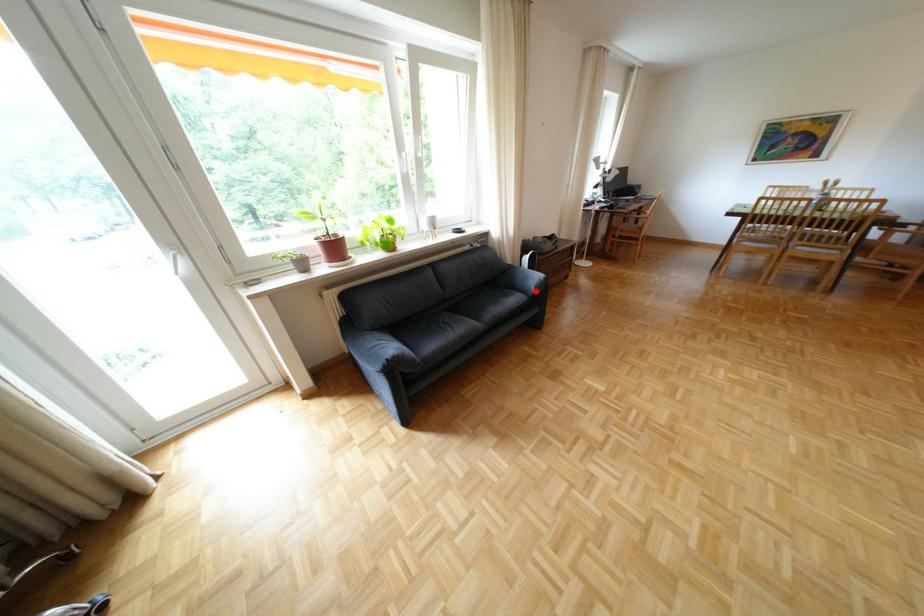
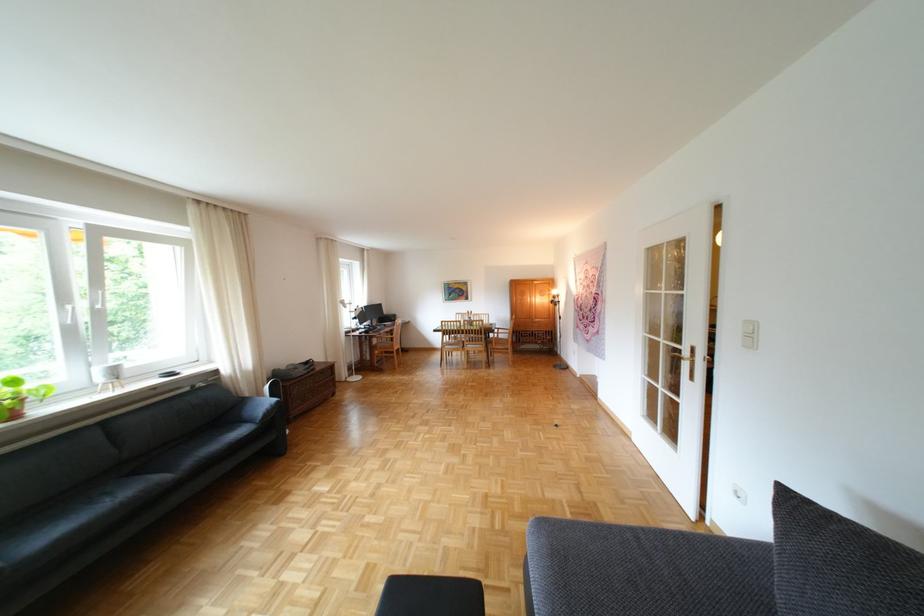
In the second image, find the point that corresponds to the highlighted location in the first image.

(263, 421)